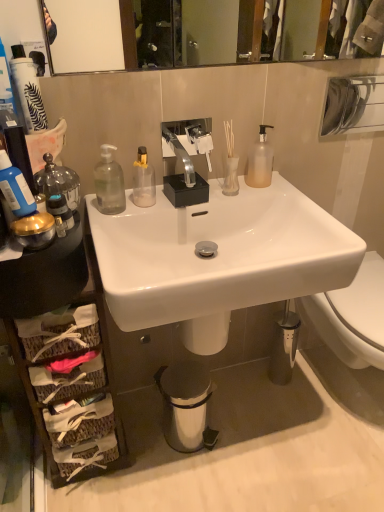
Identify the location of free space to the left of metallic trash can at lower center. (139, 432).